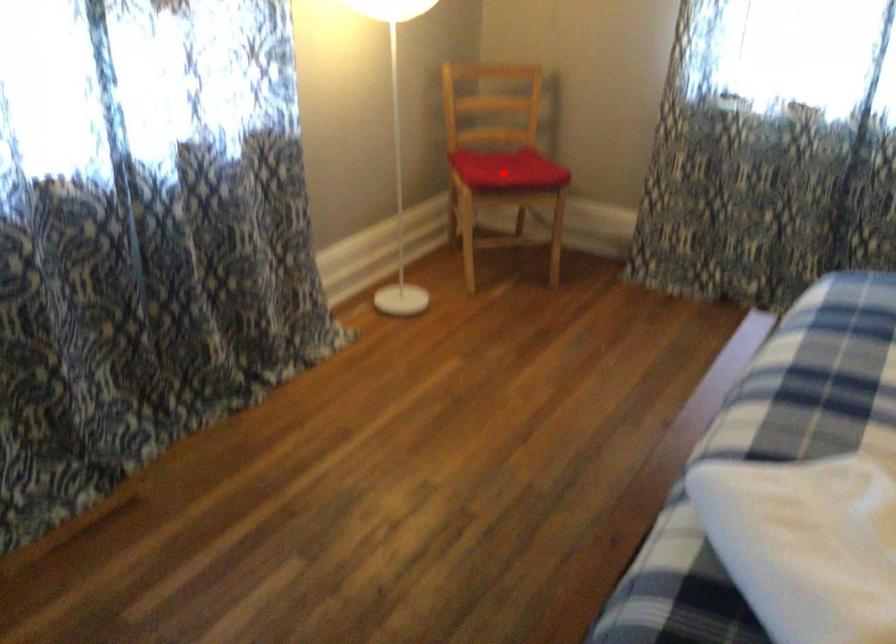
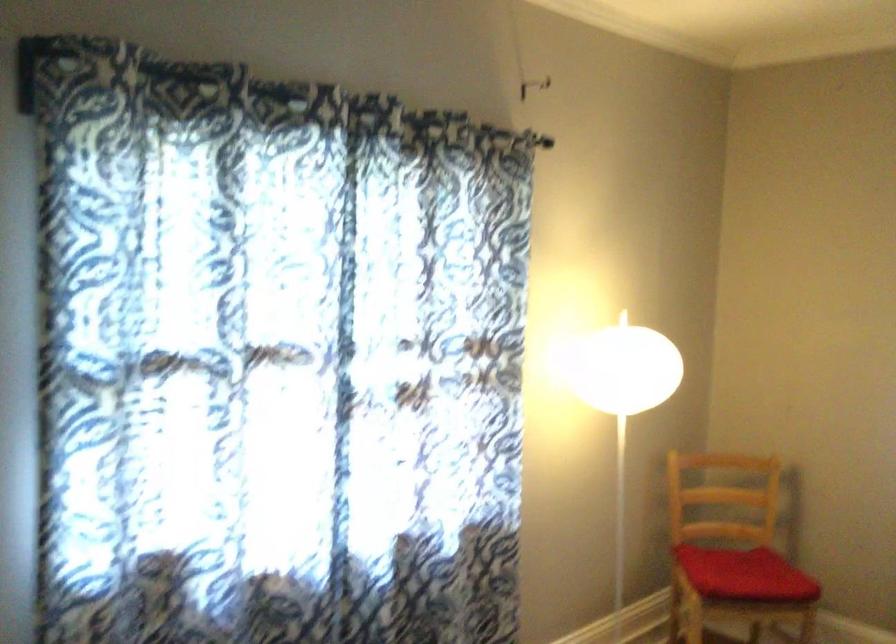
Find the pixel in the second image that matches the highlighted location in the first image.

(745, 574)